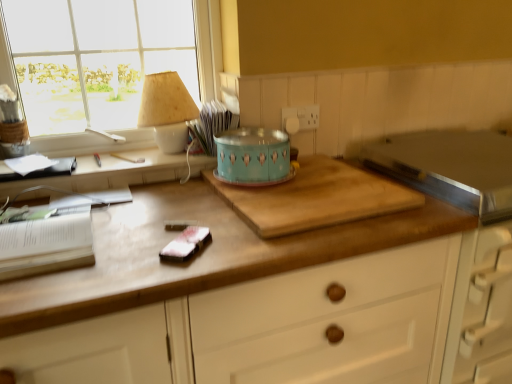
This screenshot has height=384, width=512. Find the location of `free space on the front side of satin pink fabric at center`. free space on the front side of satin pink fabric at center is located at coordinates (163, 267).